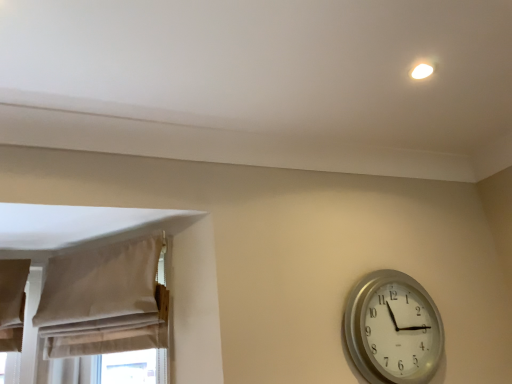
This screenshot has width=512, height=384. What do you see at coordinates (393, 329) in the screenshot? I see `silver metallic wall clock at lower right` at bounding box center [393, 329].

At what (x,y) coordinates should I click in order to perform the action: click on silver metallic wall clock at lower right. Please return your answer as a coordinate pair (x, y). This screenshot has height=384, width=512. Looking at the image, I should click on (393, 329).

The height and width of the screenshot is (384, 512). What do you see at coordinates (104, 301) in the screenshot? I see `beige fabric curtain at left` at bounding box center [104, 301].

At what (x,y) coordinates should I click in order to perform the action: click on beige fabric curtain at left. Please return your answer as a coordinate pair (x, y). This screenshot has width=512, height=384. Looking at the image, I should click on (104, 301).

Image resolution: width=512 pixels, height=384 pixels. In order to click on silver metallic wall clock at lower right in this screenshot , I will do `click(393, 329)`.

Based on their positions, is beige fabric curtain at left located to the left or right of silver metallic wall clock at lower right?

Clearly, beige fabric curtain at left is on the left of silver metallic wall clock at lower right in the image.

Considering the positions of objects beige fabric curtain at left and silver metallic wall clock at lower right in the image provided, who is in front, beige fabric curtain at left or silver metallic wall clock at lower right?

beige fabric curtain at left is more forward.

Considering the points (95, 339) and (375, 303), which point is behind, point (95, 339) or point (375, 303)?

The point (375, 303) is farther.

From the image's perspective, is beige fabric curtain at left below silver metallic wall clock at lower right?

Actually, beige fabric curtain at left appears above silver metallic wall clock at lower right in the image.

From a real-world perspective, is beige fabric curtain at left under silver metallic wall clock at lower right?

No, from a real-world perspective, beige fabric curtain at left is not beneath silver metallic wall clock at lower right.

Considering the relative sizes of beige fabric curtain at left and silver metallic wall clock at lower right in the image provided, is beige fabric curtain at left thinner than silver metallic wall clock at lower right?

No.

Who is taller, beige fabric curtain at left or silver metallic wall clock at lower right?

silver metallic wall clock at lower right.

Does beige fabric curtain at left have a smaller size compared to silver metallic wall clock at lower right?

No, beige fabric curtain at left is not smaller than silver metallic wall clock at lower right.

Is beige fabric curtain at left positioned beyond the bounds of silver metallic wall clock at lower right?

Indeed, beige fabric curtain at left is completely outside silver metallic wall clock at lower right.

Does beige fabric curtain at left touch silver metallic wall clock at lower right?

No.

Is beige fabric curtain at left oriented away from silver metallic wall clock at lower right?

beige fabric curtain at left is not turned away from silver metallic wall clock at lower right.

This screenshot has height=384, width=512. In order to click on curtain in front of the silver metallic wall clock at lower right in this screenshot , I will do `click(104, 301)`.

In the image, is silver metallic wall clock at lower right on the left side or the right side of beige fabric curtain at left?

silver metallic wall clock at lower right is positioned on beige fabric curtain at left's right side.

Which is in front, silver metallic wall clock at lower right or beige fabric curtain at left?

beige fabric curtain at left.

Is point (364, 376) closer or farther from the camera than point (113, 285)?

Point (364, 376) appears to be closer to the viewer than point (113, 285).

From the image's perspective, is silver metallic wall clock at lower right above or below beige fabric curtain at left?

Clearly, from the image's perspective, silver metallic wall clock at lower right is below beige fabric curtain at left.

From a real-world perspective, is silver metallic wall clock at lower right over beige fabric curtain at left?

Actually, silver metallic wall clock at lower right is physically below beige fabric curtain at left in the real world.

Considering the sizes of silver metallic wall clock at lower right and beige fabric curtain at left in the image, is silver metallic wall clock at lower right wider or thinner than beige fabric curtain at left?

Clearly, silver metallic wall clock at lower right has less width compared to beige fabric curtain at left.

Does silver metallic wall clock at lower right have a lesser height compared to beige fabric curtain at left?

No.

Considering the sizes of objects silver metallic wall clock at lower right and beige fabric curtain at left in the image provided, who is smaller, silver metallic wall clock at lower right or beige fabric curtain at left?

silver metallic wall clock at lower right is smaller.

Is silver metallic wall clock at lower right located outside beige fabric curtain at left?

Yes, silver metallic wall clock at lower right is outside of beige fabric curtain at left.

Can you see silver metallic wall clock at lower right touching beige fabric curtain at left?

They are not placed beside each other.

Is silver metallic wall clock at lower right facing towards beige fabric curtain at left?

No, silver metallic wall clock at lower right is not facing towards beige fabric curtain at left.

Can you tell me how much silver metallic wall clock at lower right and beige fabric curtain at left differ in facing direction?

The facing directions of silver metallic wall clock at lower right and beige fabric curtain at left are 45.1 degrees apart.

At what (x,y) coordinates should I click in order to perform the action: click on wall clock behind the beige fabric curtain at left. Please return your answer as a coordinate pair (x, y). This screenshot has height=384, width=512. Looking at the image, I should click on (393, 329).

Where is `curtain above the silver metallic wall clock at lower right (from the image's perspective)`? The height and width of the screenshot is (384, 512). curtain above the silver metallic wall clock at lower right (from the image's perspective) is located at coordinates (104, 301).

Where is `wall clock that is on the right side of beige fabric curtain at left`? This screenshot has width=512, height=384. wall clock that is on the right side of beige fabric curtain at left is located at coordinates (393, 329).